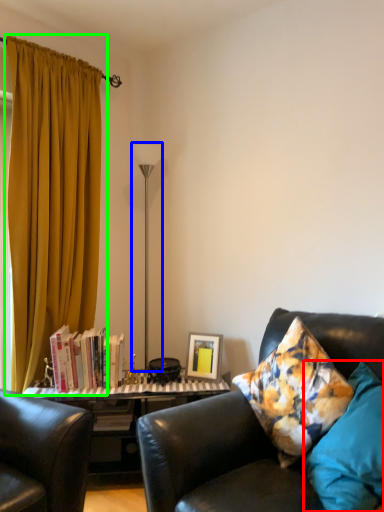
Question: Considering the real-world distances, which object is farthest from pillow (highlighted by a red box)? lamp (highlighted by a blue box) or curtain (highlighted by a green box)?

Choices:
 (A) lamp
 (B) curtain

Answer: (A)